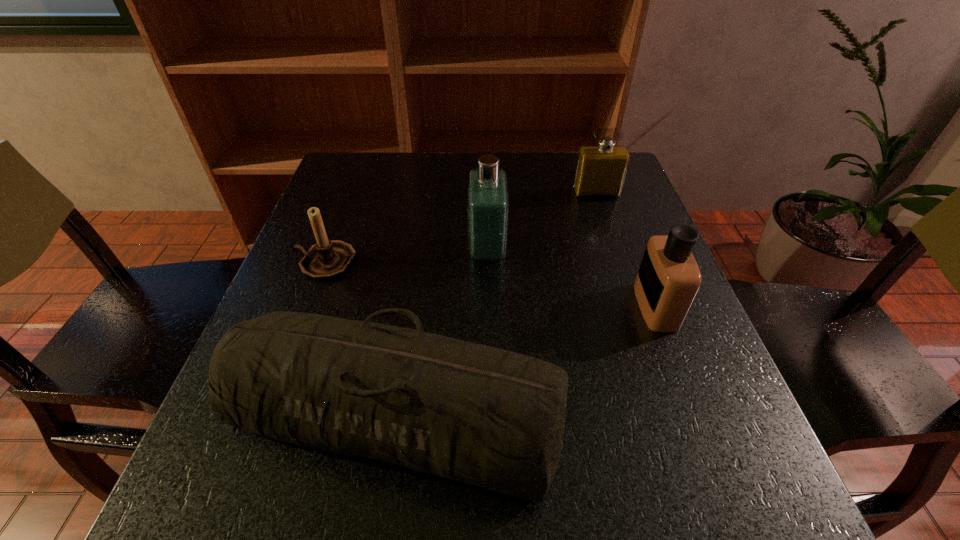
At what (x,y) coordinates should I click in order to perform the action: click on vacant point located 0.310m on the front label of the second nearest object. Please return your answer as a coordinate pair (x, y). This screenshot has height=540, width=960. Looking at the image, I should click on (478, 306).

Locate an element on the screen. This screenshot has width=960, height=540. free point located 0.090m on the front label of the second nearest object is located at coordinates (592, 306).

Find the location of a particular element. The width and height of the screenshot is (960, 540). free space located on the front-facing side of the farthest object is located at coordinates (614, 247).

In order to click on vacant area situated on the back of the nearest object in this screenshot , I will do `click(424, 218)`.

The image size is (960, 540). I want to click on free point located 0.360m on the back of the candle holder, so click(362, 163).

At what (x,y) coordinates should I click in order to perform the action: click on object present at the far edge. Please return your answer as a coordinate pair (x, y). Looking at the image, I should click on (601, 169).

Identify the location of object situated at the near edge. Image resolution: width=960 pixels, height=540 pixels. (492, 418).

I want to click on duffel bag present at the left edge, so click(x=492, y=418).

Locate an element on the screen. The height and width of the screenshot is (540, 960). candle holder situated at the left edge is located at coordinates (326, 260).

The image size is (960, 540). I want to click on object that is at the near left corner, so click(x=492, y=418).